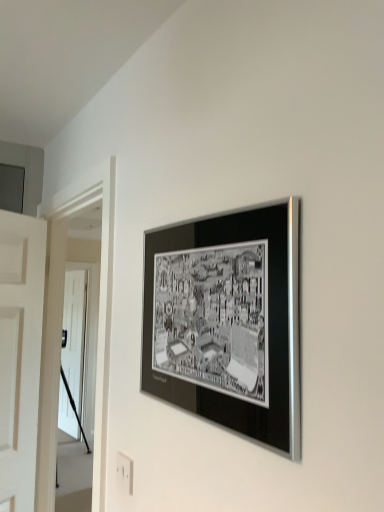
Question: From the image's perspective, relative to white plastic electric outlet at lower center, is black metallic frame at upper center above or below?

Choices:
 (A) above
 (B) below

Answer: (A)

Question: From their relative heights in the image, would you say black metallic frame at upper center is taller or shorter than white plastic electric outlet at lower center?

Choices:
 (A) tall
 (B) short

Answer: (A)

Question: Estimate the real-world distances between objects in this image. Which object is farther from the black metallic frame at upper center?

Choices:
 (A) white plastic electric outlet at lower center
 (B) white glossy door at left

Answer: (B)

Question: Which object is positioned closest to the white glossy door at left?

Choices:
 (A) black metallic frame at upper center
 (B) white plastic electric outlet at lower center

Answer: (B)